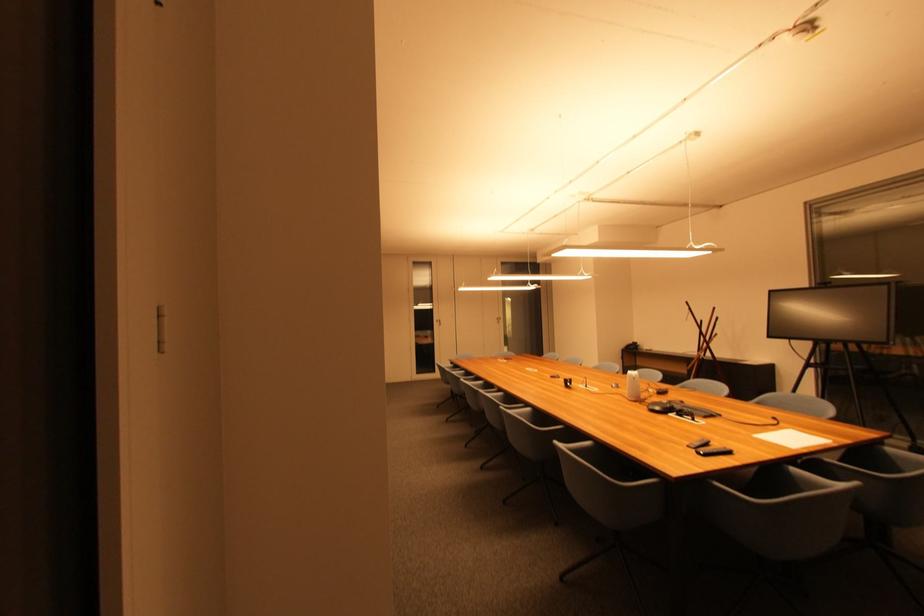
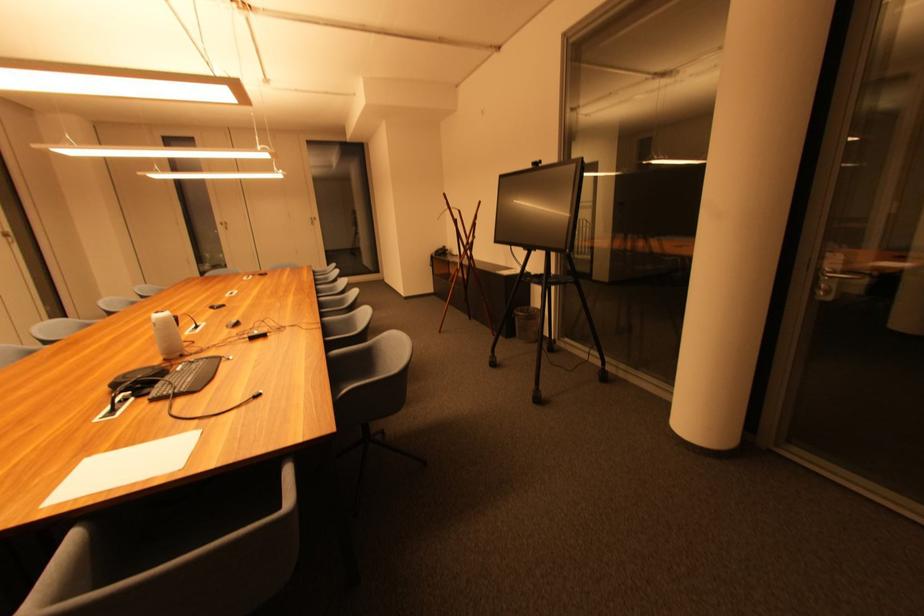
Find the pixel in the second image that matches point 443,323 in the first image.

(226, 225)